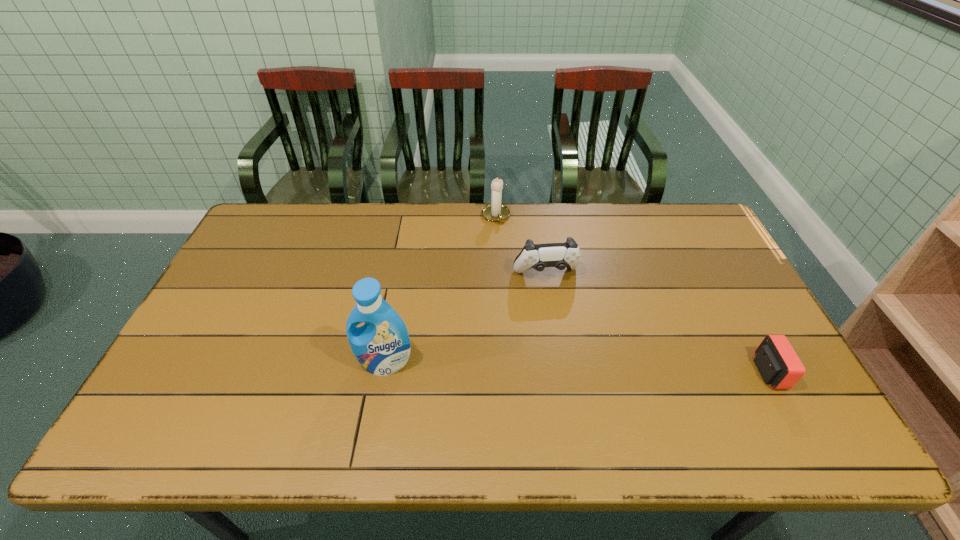
Locate an element on the screen. The height and width of the screenshot is (540, 960). free region located 0.070m on the front-facing side of the third nearest object is located at coordinates (555, 302).

Identify the location of free point located on the front-facing side of the third nearest object. (566, 341).

At what (x,y) coordinates should I click in order to perform the action: click on vacant space located 0.090m on the handle side of the farthest object. Please return your answer as a coordinate pair (x, y). The image size is (960, 540). Looking at the image, I should click on (506, 243).

Locate an element on the screen. The image size is (960, 540). vacant area situated on the handle side of the farthest object is located at coordinates (531, 304).

You are a GUI agent. You are given a task and a screenshot of the screen. Output one action in this format:
    pyautogui.click(x=<x>, y=<y>)
    Task: Click on the vacant region located 0.300m on the handle side of the farthest object
    This screenshot has width=960, height=540.
    Given the screenshot: What is the action you would take?
    pyautogui.click(x=524, y=287)

Where is `object positioned at the far edge`? This screenshot has height=540, width=960. object positioned at the far edge is located at coordinates (496, 212).

Identify the location of object positioned at the near edge. (775, 359).

Where is `object located in the right edge section of the desktop`? Image resolution: width=960 pixels, height=540 pixels. object located in the right edge section of the desktop is located at coordinates (775, 359).

The height and width of the screenshot is (540, 960). Find the location of `object that is at the near right corner`. object that is at the near right corner is located at coordinates (775, 359).

The width and height of the screenshot is (960, 540). In order to click on blank area at the far edge in this screenshot , I will do `click(642, 234)`.